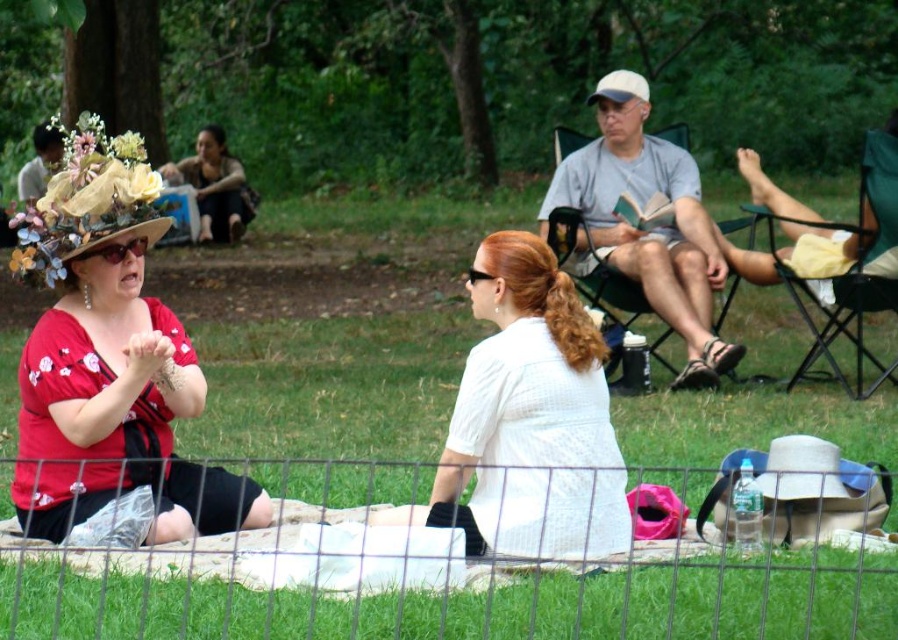
Who is positioned more to the right, metal wire fence at lower center or matte floral hat at upper left?

From the viewer's perspective, metal wire fence at lower center appears more on the right side.

Between metal wire fence at lower center and matte floral hat at upper left, which one appears on the left side from the viewer's perspective?

From the viewer's perspective, matte floral hat at upper left appears more on the left side.

Between point (279, 614) and point (58, 147), which one is positioned behind?

Positioned behind is point (58, 147).

Where is `metal wire fence at lower center`? The image size is (898, 640). metal wire fence at lower center is located at coordinates (458, 596).

Can you confirm if floral fabric hat at upper left is bigger than matte floral hat at upper left?

Yes, floral fabric hat at upper left is bigger than matte floral hat at upper left.

Can you confirm if floral fabric hat at upper left is smaller than matte floral hat at upper left?

No, floral fabric hat at upper left is not smaller than matte floral hat at upper left.

Is point (120, 198) positioned behind point (54, 157)?

No.

This screenshot has height=640, width=898. I want to click on floral fabric hat at upper left, so click(x=86, y=202).

Does metal wire fence at lower center appear on the left side of white textured shirt at center?

Correct, you'll find metal wire fence at lower center to the left of white textured shirt at center.

What do you see at coordinates (458, 596) in the screenshot? I see `metal wire fence at lower center` at bounding box center [458, 596].

This screenshot has height=640, width=898. In order to click on metal wire fence at lower center in this screenshot , I will do `click(458, 596)`.